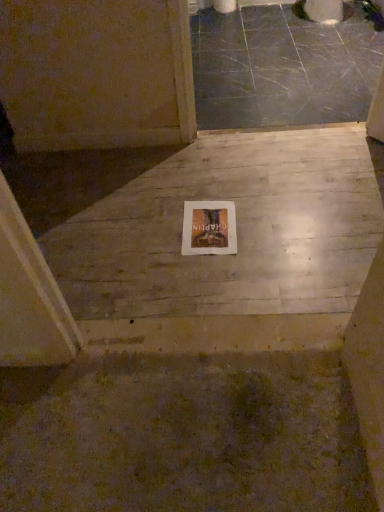
Question: Can you confirm if white wood floor at center, which is the 2th concrete from back to front, is shorter than gray polished concrete at upper center, the 1th concrete from the back?

Choices:
 (A) no
 (B) yes

Answer: (A)

Question: Is white wood floor at center, which is the first concrete from front to back, wider than gray polished concrete at upper center, which is counted as the first concrete, starting from the top?

Choices:
 (A) yes
 (B) no

Answer: (B)

Question: Is white wood floor at center, the first concrete from the bottom, positioned with its back to gray polished concrete at upper center, which is counted as the 2th concrete, starting from the front?

Choices:
 (A) no
 (B) yes

Answer: (B)

Question: Considering the relative sizes of white wood floor at center, which is the first concrete from front to back, and gray polished concrete at upper center, which is counted as the 2th concrete, starting from the front, in the image provided, is white wood floor at center, which is the first concrete from front to back, bigger than gray polished concrete at upper center, which is counted as the 2th concrete, starting from the front,?

Choices:
 (A) no
 (B) yes

Answer: (A)

Question: Is white wood floor at center, which is the first concrete from front to back, directly adjacent to gray polished concrete at upper center, which is counted as the 2th concrete, starting from the front?

Choices:
 (A) yes
 (B) no

Answer: (B)

Question: Is the position of white wood floor at center, positioned as the 2th concrete in top-to-bottom order, more distant than that of gray polished concrete at upper center, which is counted as the first concrete, starting from the top?

Choices:
 (A) no
 (B) yes

Answer: (A)

Question: Does gray polished concrete at upper center, which is counted as the 2th concrete, starting from the front, come in front of wooden book at center?

Choices:
 (A) no
 (B) yes

Answer: (A)

Question: Is gray polished concrete at upper center, which is counted as the first concrete, starting from the top, positioned beyond the bounds of wooden book at center?

Choices:
 (A) no
 (B) yes

Answer: (B)

Question: Considering the relative sizes of gray polished concrete at upper center, the 1th concrete from the back, and wooden book at center in the image provided, is gray polished concrete at upper center, the 1th concrete from the back, wider than wooden book at center?

Choices:
 (A) yes
 (B) no

Answer: (A)

Question: From the image's perspective, is gray polished concrete at upper center, which is counted as the 2th concrete, starting from the front, located above wooden book at center?

Choices:
 (A) yes
 (B) no

Answer: (A)

Question: Does gray polished concrete at upper center, which is counted as the first concrete, starting from the top, have a larger size compared to wooden book at center?

Choices:
 (A) no
 (B) yes

Answer: (B)

Question: Can you confirm if gray polished concrete at upper center, which is counted as the first concrete, starting from the top, is positioned to the right of wooden book at center?

Choices:
 (A) no
 (B) yes

Answer: (B)